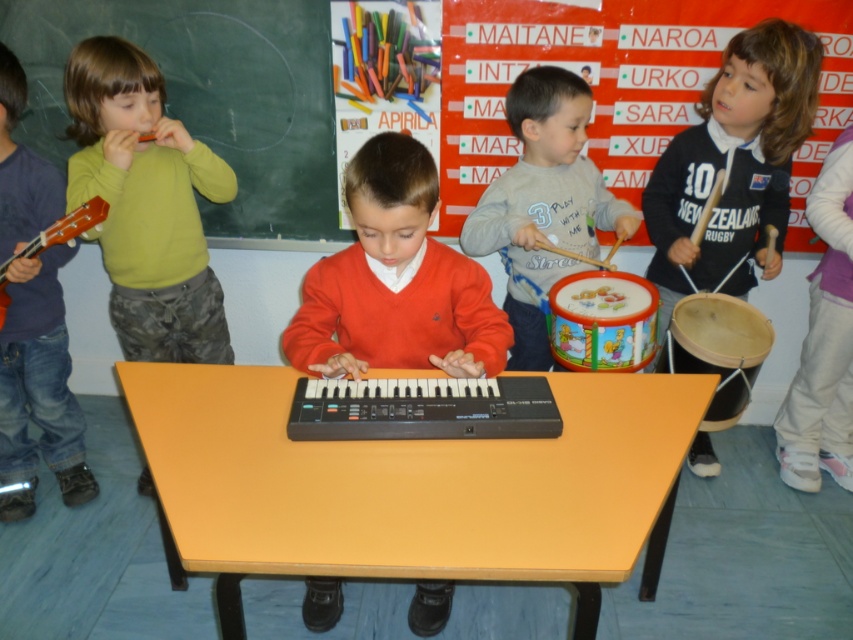
Between blackboard at upper left and wooden drum at right, which one appears on the right side from the viewer's perspective?

wooden drum at right

Which is more to the left, blackboard at upper left or wooden drum at right?

blackboard at upper left

The height and width of the screenshot is (640, 853). I want to click on blackboard at upper left, so click(x=209, y=96).

Where is `matte orange sweater at center`? matte orange sweater at center is located at coordinates (395, 282).

Is matte orange sweater at center closer to camera compared to blue denim jeans at left?

Yes, it is in front of blue denim jeans at left.

I want to click on matte orange sweater at center, so click(395, 282).

Which is behind, point (292, 364) or point (15, 376)?

Positioned behind is point (15, 376).

What are the coordinates of `matte orange sweater at center` in the screenshot? It's located at point(395,282).